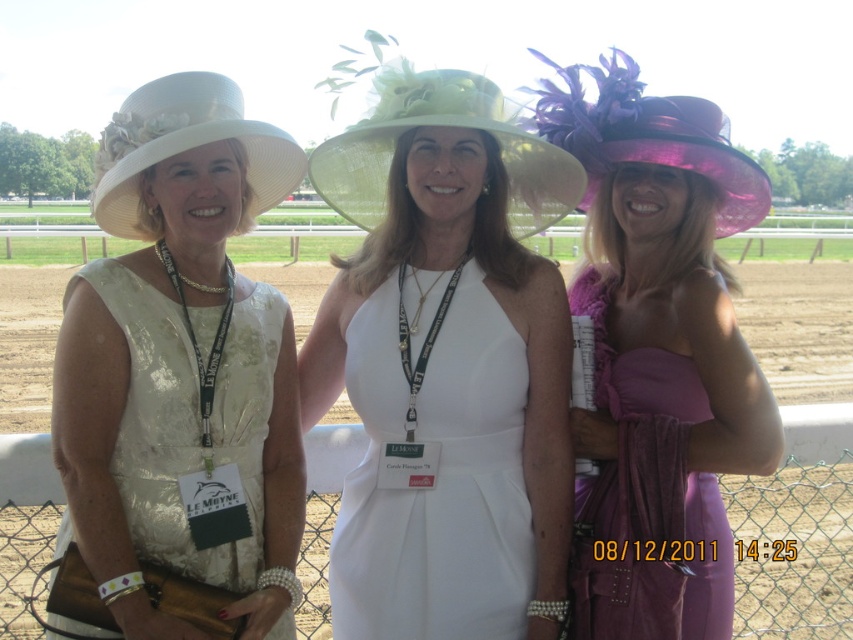
Question: Considering the real-world distances, which object is farthest from the white straw hat at center?

Choices:
 (A) brown dirt track at center
 (B) matte white dress at center

Answer: (A)

Question: Does white straw hat at center have a smaller size compared to purple glossy hat at center?

Choices:
 (A) yes
 (B) no

Answer: (B)

Question: Can you confirm if matte white dress at center is positioned to the right of brown dirt track at center?

Choices:
 (A) yes
 (B) no

Answer: (A)

Question: Which point is farther to the camera?

Choices:
 (A) (671, 147)
 (B) (323, 170)
 (C) (805, 561)

Answer: (C)

Question: Estimate the real-world distances between objects in this image. Which object is farther from the brown dirt track at center?

Choices:
 (A) purple glossy hat at center
 (B) purple satin hat at center
 (C) light green straw hat at center

Answer: (A)

Question: Is matte white dress at center below purple satin hat at center?

Choices:
 (A) yes
 (B) no

Answer: (A)